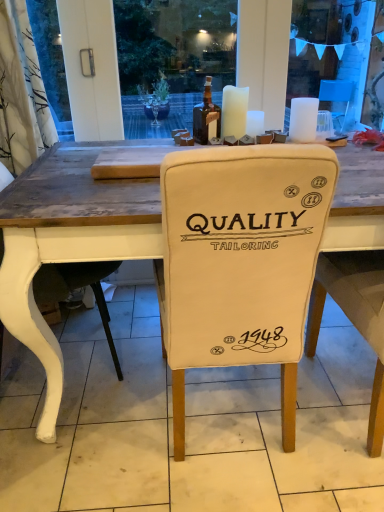
Question: Does white fabric chair at center have a lesser height compared to white matte candle at upper center, which is the first candle from left to right?

Choices:
 (A) yes
 (B) no

Answer: (B)

Question: From the image's perspective, is white fabric chair at center beneath white matte candle at upper center, which is the first candle from left to right?

Choices:
 (A) yes
 (B) no

Answer: (A)

Question: Is white fabric chair at center positioned in front of white matte candle at upper center, the 3th candle when ordered from right to left?

Choices:
 (A) no
 (B) yes

Answer: (B)

Question: Is white fabric chair at center wider than white matte candle at upper center, which is the first candle from left to right?

Choices:
 (A) yes
 (B) no

Answer: (A)

Question: Does white fabric chair at center have a greater height compared to white matte candle at upper center, which is the first candle from left to right?

Choices:
 (A) yes
 (B) no

Answer: (A)

Question: Is the surface of white fabric chair at center in direct contact with white matte candle at upper center, which is the first candle from left to right?

Choices:
 (A) no
 (B) yes

Answer: (A)

Question: Can you confirm if white fabric chair at left is bigger than brown glass bottle at upper center?

Choices:
 (A) no
 (B) yes

Answer: (B)

Question: Can you confirm if white fabric chair at left is shorter than brown glass bottle at upper center?

Choices:
 (A) yes
 (B) no

Answer: (B)

Question: Is white fabric chair at left located outside brown glass bottle at upper center?

Choices:
 (A) yes
 (B) no

Answer: (A)

Question: From a real-world perspective, is white fabric chair at left under brown glass bottle at upper center?

Choices:
 (A) yes
 (B) no

Answer: (A)

Question: Is white fabric chair at left oriented towards brown glass bottle at upper center?

Choices:
 (A) yes
 (B) no

Answer: (A)

Question: Is white fabric chair at left at the left side of brown glass bottle at upper center?

Choices:
 (A) no
 (B) yes

Answer: (B)

Question: Would you consider white wax candle at center, the 2th candle in the left-to-right sequence, to be distant from white matte candle at upper center, which is the first candle from left to right?

Choices:
 (A) yes
 (B) no

Answer: (B)